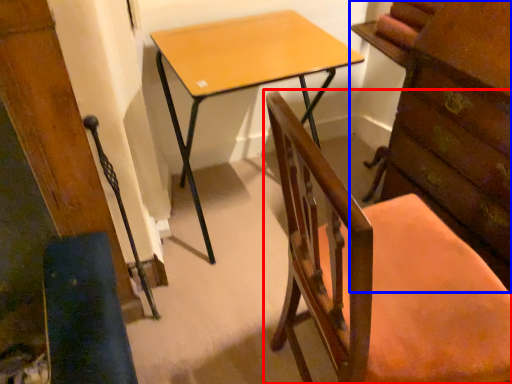
Question: Which object appears farthest to the camera in this image, chair (highlighted by a red box) or chest of drawers (highlighted by a blue box)?

Choices:
 (A) chair
 (B) chest of drawers

Answer: (B)